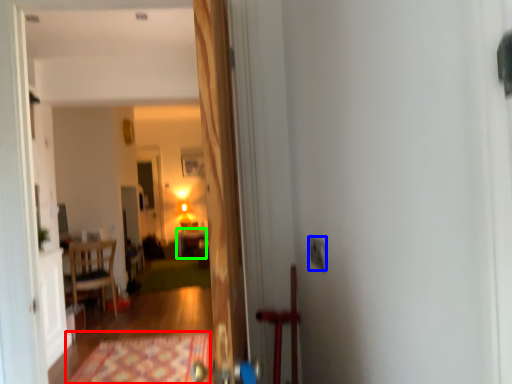
Question: Which is nearer to the doormat (highlighted by a red box)? electric outlet (highlighted by a blue box) or table (highlighted by a green box).

Choices:
 (A) electric outlet
 (B) table

Answer: (A)